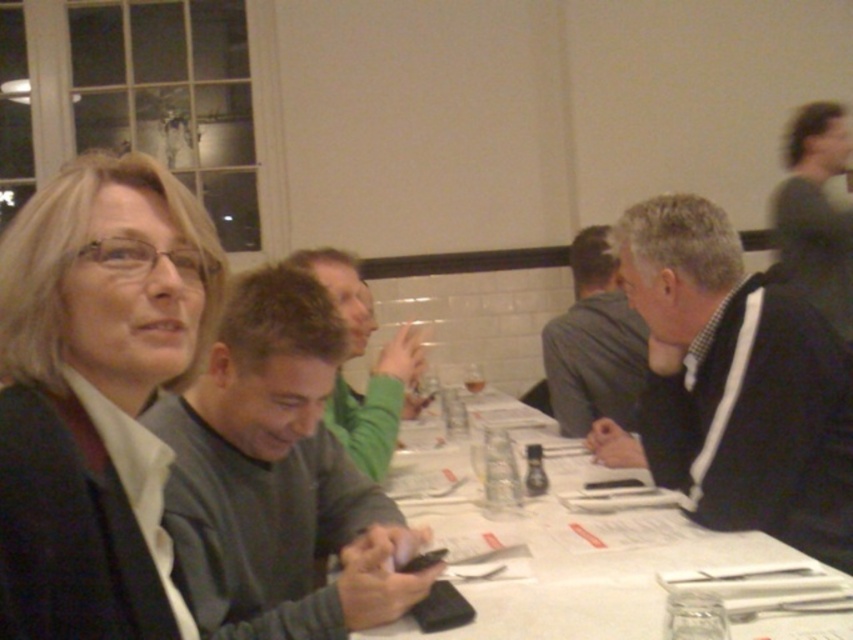
Question: Which point is farther to the camera?

Choices:
 (A) black sweater at right
 (B) matte black jacket at left
 (C) transparent glass at table center
 (D) white paper at center

Answer: (A)

Question: Is black sweater at right to the right of white paper at center from the viewer's perspective?

Choices:
 (A) no
 (B) yes

Answer: (B)

Question: Which of the following is the closest to the observer?

Choices:
 (A) white paper at center
 (B) transparent glass at table center

Answer: (B)

Question: Which of the following is the farthest from the observer?

Choices:
 (A) matte black jacket at left
 (B) black sweater at right
 (C) transparent glass at center
 (D) white paper at center

Answer: (C)

Question: Where is matte black jacket at left located in relation to transparent glass at center in the image?

Choices:
 (A) left
 (B) right

Answer: (A)

Question: Is black sweater at right thinner than transparent glass at table center?

Choices:
 (A) yes
 (B) no

Answer: (B)